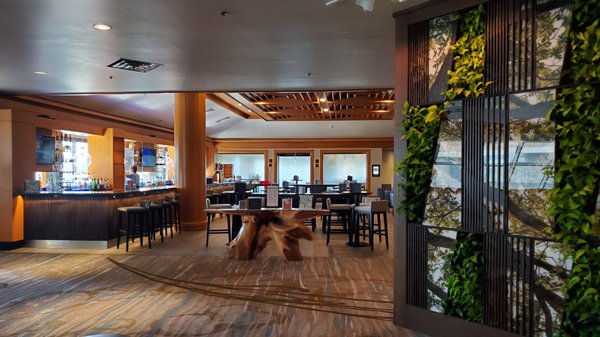
Find the location of a particular element. This screenshot has width=600, height=337. counter of the bar is located at coordinates (89, 193), (151, 188).